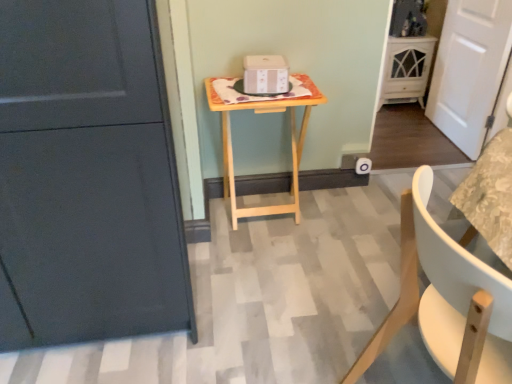
Question: Is white wooden door at right positioned with its back to light wood/texture table at center?

Choices:
 (A) yes
 (B) no

Answer: (B)

Question: Does white wooden door at right have a smaller size compared to light wood/texture table at center?

Choices:
 (A) no
 (B) yes

Answer: (B)

Question: Can you see white wooden door at right touching light wood/texture table at center?

Choices:
 (A) yes
 (B) no

Answer: (B)

Question: Considering the relative sizes of white wooden door at right and light wood/texture table at center in the image provided, is white wooden door at right shorter than light wood/texture table at center?

Choices:
 (A) yes
 (B) no

Answer: (B)

Question: Is white wooden door at right oriented towards light wood/texture table at center?

Choices:
 (A) yes
 (B) no

Answer: (A)

Question: Does white wooden door at right contain light wood/texture table at center?

Choices:
 (A) no
 (B) yes

Answer: (A)

Question: Would you consider white glossy cabinet at upper right to be distant from light wood/texture table at center?

Choices:
 (A) yes
 (B) no

Answer: (A)

Question: Is the position of white glossy cabinet at upper right more distant than that of light wood/texture table at center?

Choices:
 (A) yes
 (B) no

Answer: (A)

Question: Is white glossy cabinet at upper right surrounding light wood/texture table at center?

Choices:
 (A) yes
 (B) no

Answer: (B)

Question: Can you confirm if white glossy cabinet at upper right is wider than light wood/texture table at center?

Choices:
 (A) yes
 (B) no

Answer: (B)

Question: Does white glossy cabinet at upper right have a greater height compared to light wood/texture table at center?

Choices:
 (A) yes
 (B) no

Answer: (B)

Question: Is white glossy cabinet at upper right looking in the opposite direction of light wood/texture table at center?

Choices:
 (A) no
 (B) yes

Answer: (A)

Question: Does light wood/texture table at center lie in front of white wooden door at right?

Choices:
 (A) no
 (B) yes

Answer: (B)